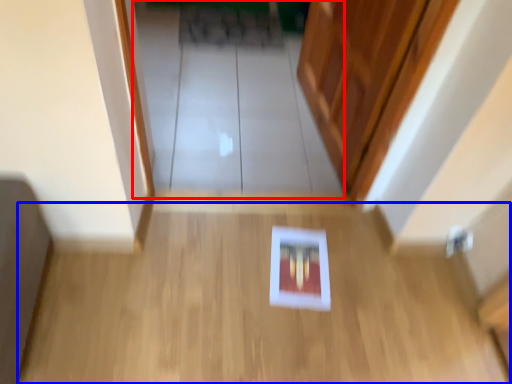
Question: Which object appears closest to the camera in this image, glass door (highlighted by a red box) or corridor (highlighted by a blue box)?

Choices:
 (A) glass door
 (B) corridor

Answer: (B)